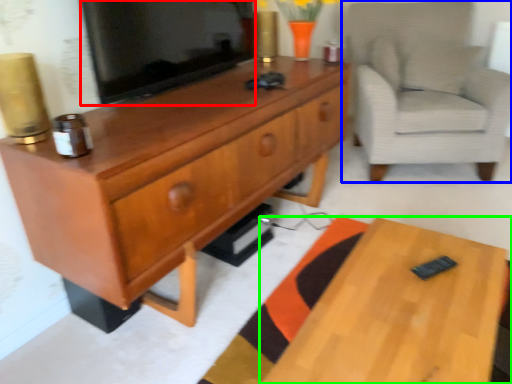
Question: Considering the real-world distances, which object is closest to television (highlighted by a red box)? chair (highlighted by a blue box) or desk (highlighted by a green box).

Choices:
 (A) chair
 (B) desk

Answer: (B)